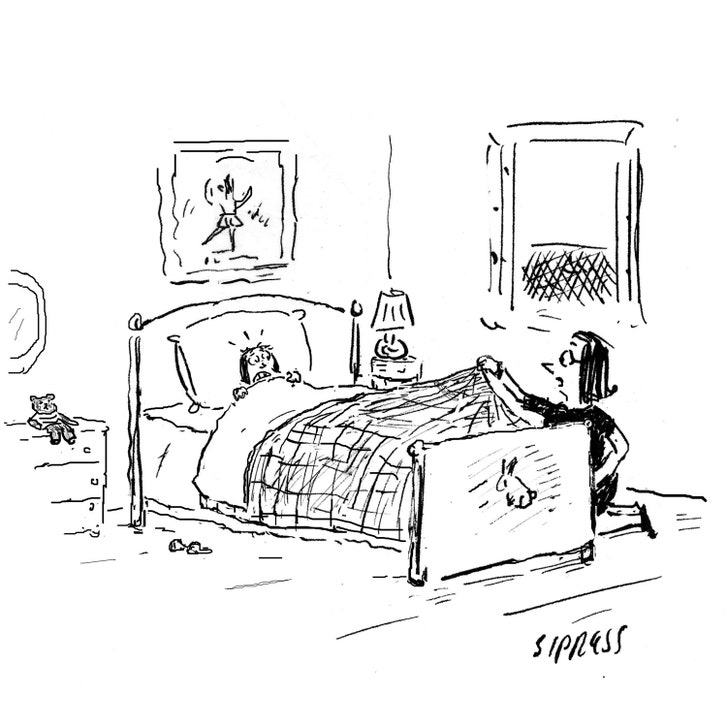
Identify the location of hand drawn mirror frame on wall. The height and width of the screenshot is (727, 727). (23, 286), (41, 313), (38, 345), (12, 365).